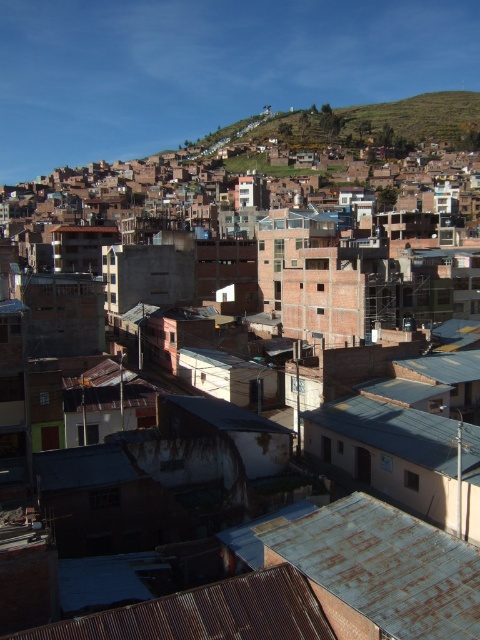
You are standing in the urban area and want to determine the distance between two points marked in the image. Which point is closer to you, point 1 at coordinates point (319, 540) or point 2 at coordinates point (335, 410)?

Point 1 at coordinates point (319, 540) is closer to you than point 2 at coordinates point (335, 410).

You are a delivery person trying to navigate between the rusty corrugated metal roof at lower center and the rusty metal roof at center. Which roof is lower in elevation?

The rusty corrugated metal roof at lower center is lower in elevation than the rusty metal roof at center.